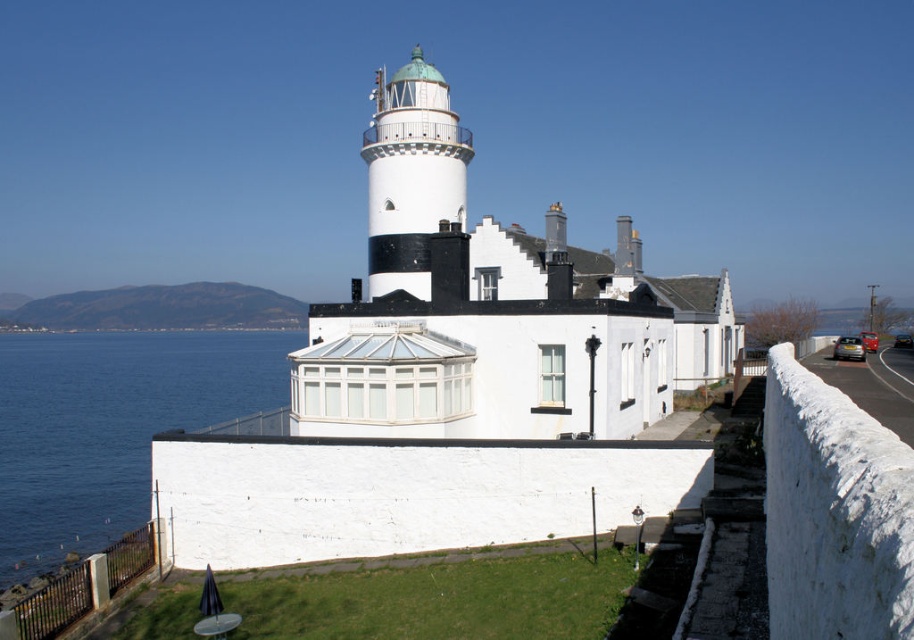
Question: Which of the following is the farthest from the observer?

Choices:
 (A) (248, 333)
 (B) (462, 156)

Answer: (A)

Question: Which point appears farthest from the camera in this image?

Choices:
 (A) (56, 545)
 (B) (397, 131)

Answer: (A)

Question: Is the position of blue water at lower left more distant than that of white painted metal lighthouse at center?

Choices:
 (A) no
 (B) yes

Answer: (B)

Question: Which object appears farthest from the camera in this image?

Choices:
 (A) white painted metal lighthouse at center
 (B) blue water at lower left

Answer: (B)

Question: Can you confirm if blue water at lower left is positioned to the left of white painted metal lighthouse at center?

Choices:
 (A) no
 (B) yes

Answer: (B)

Question: Can you confirm if blue water at lower left is wider than white painted metal lighthouse at center?

Choices:
 (A) yes
 (B) no

Answer: (A)